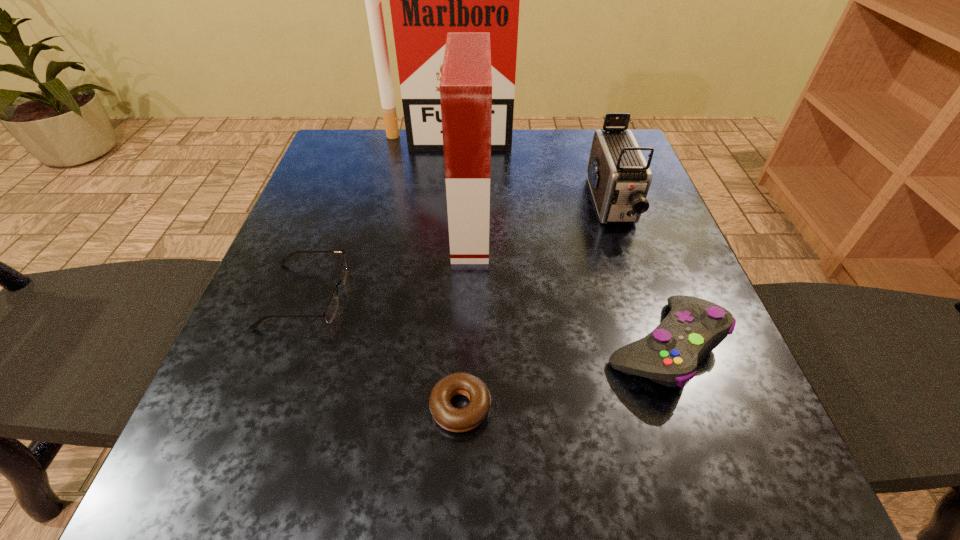
The width and height of the screenshot is (960, 540). I want to click on the farthest object, so click(427, 0).

Identify the location of the nearer cigarette_case. (466, 80).

Locate an element on the screen. The height and width of the screenshot is (540, 960). the third tallest object is located at coordinates (619, 177).

Image resolution: width=960 pixels, height=540 pixels. I want to click on control, so click(669, 355).

Find the location of a particular element. Image resolution: width=960 pixels, height=540 pixels. spectacles is located at coordinates (331, 309).

Find the location of a particular element. The width and height of the screenshot is (960, 540). the shortest object is located at coordinates (454, 419).

Find the location of a particular element. The height and width of the screenshot is (540, 960). free location located 0.070m on the front-facing side of the farther cigarette_case is located at coordinates (445, 166).

The width and height of the screenshot is (960, 540). Identify the location of vacant space located 0.350m on the front-facing side of the nearer cigarette_case. (662, 227).

The image size is (960, 540). What are the coordinates of `free region located at the lens of the fourth shortest object` in the screenshot? It's located at (633, 267).

What are the coordinates of `blank space located 0.330m on the back of the fourth tallest object` in the screenshot? It's located at (609, 188).